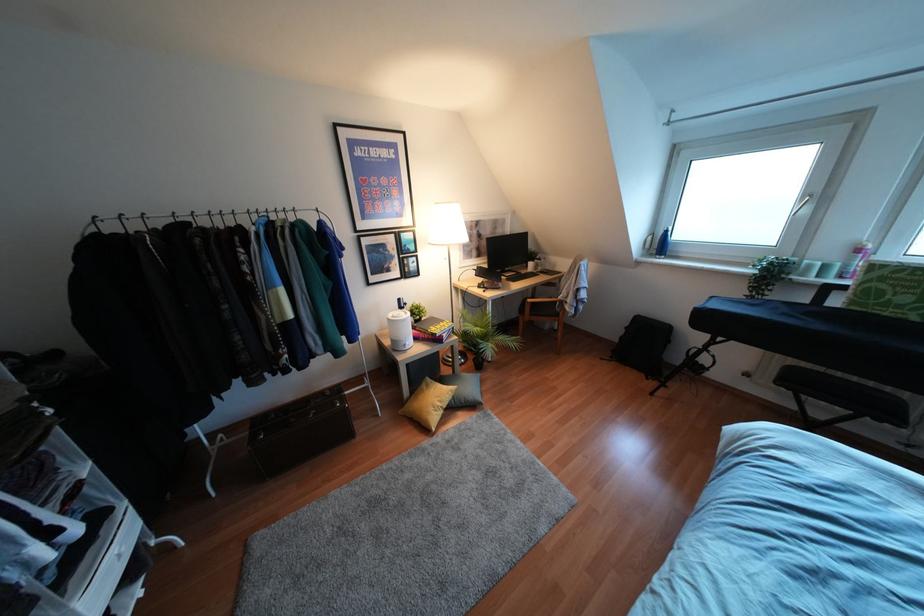
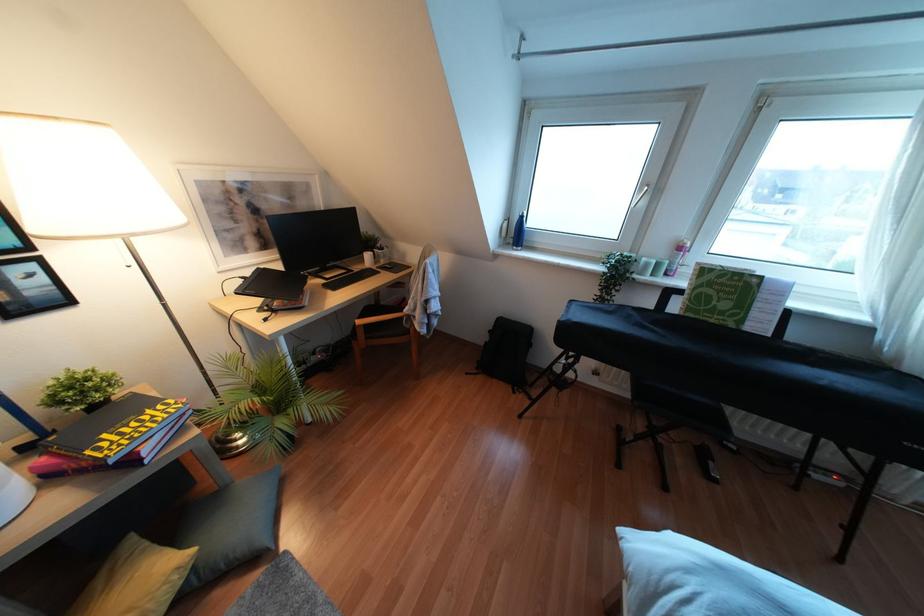
Question: The camera is either moving clockwise (left) or counter-clockwise (right) around the object. The first image is from the beginning of the video and the second image is from the end. Is the camera moving left or right when shooting the video?

Choices:
 (A) Left
 (B) Right

Answer: (A)